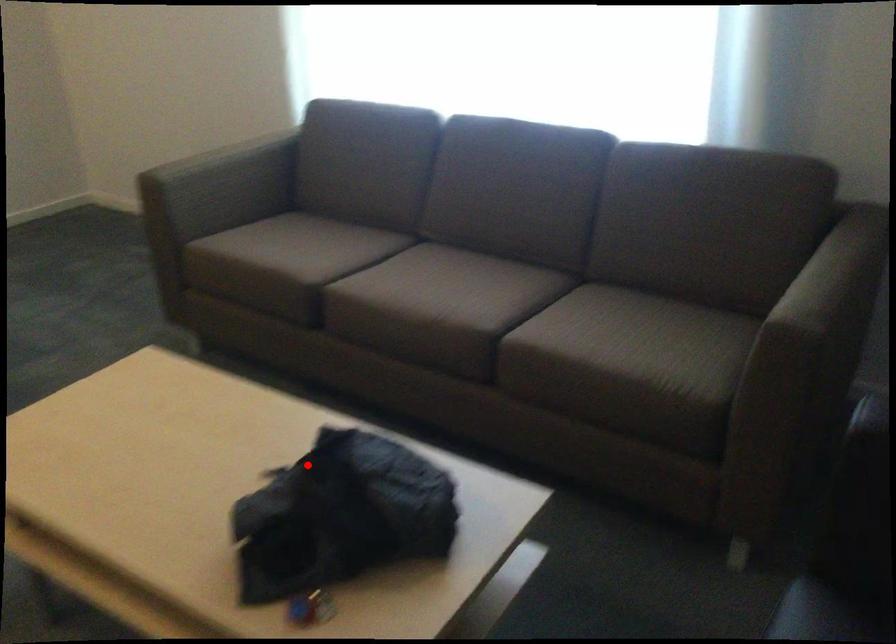
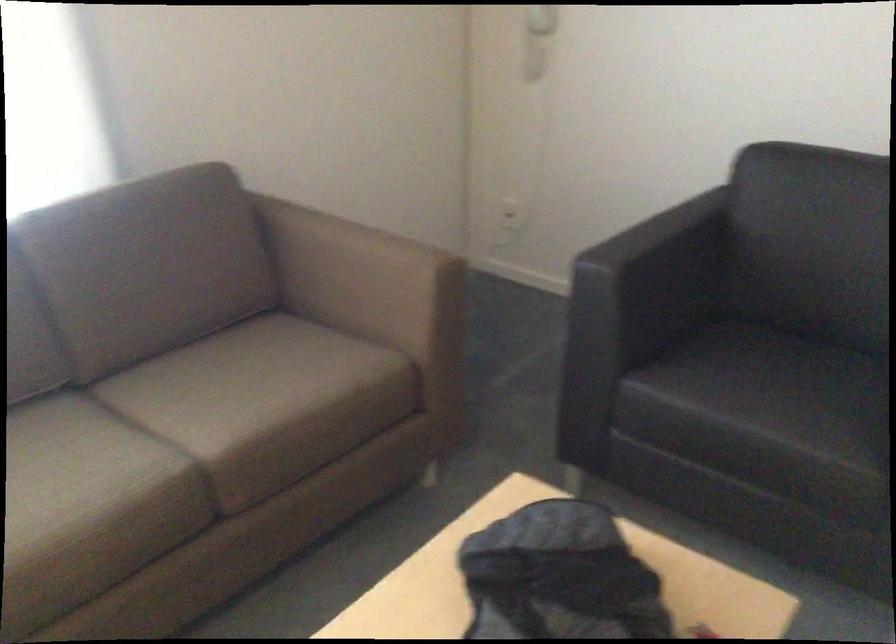
Find the pixel in the second image that matches the highlighted location in the first image.

(558, 576)